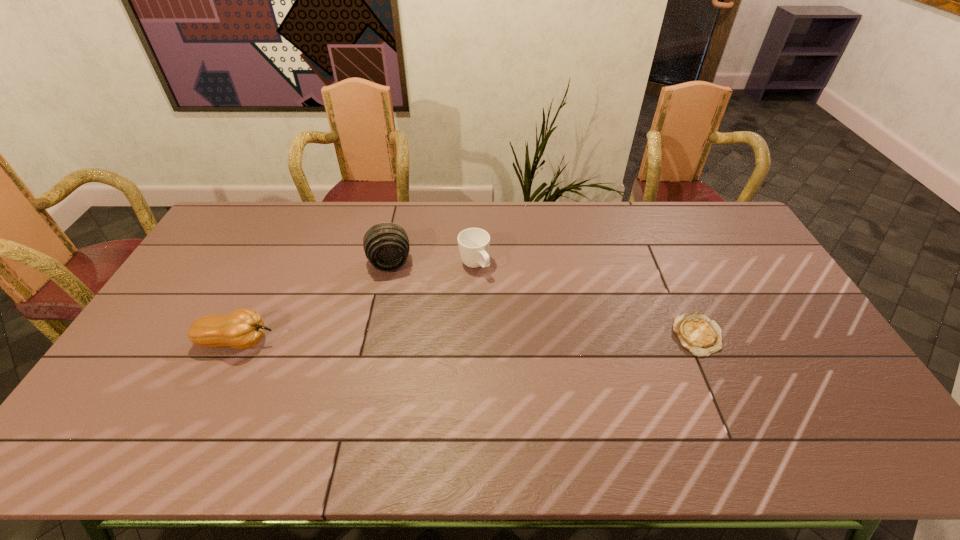
You are a GUI agent. You are given a task and a screenshot of the screen. Output one action in this format:
    pyautogui.click(x=<x>, y=<y>)
    Task: Click on the free space on the desktop that is between the gourd and the rightmost object and is positioned with the handle on the side of the cup
    The height and width of the screenshot is (540, 960).
    Given the screenshot: What is the action you would take?
    pyautogui.click(x=533, y=338)

Identify the location of free spot on the desktop that is between the gourd and the rightmost object and is positioned at the front element of the telephoto lens. (403, 340).